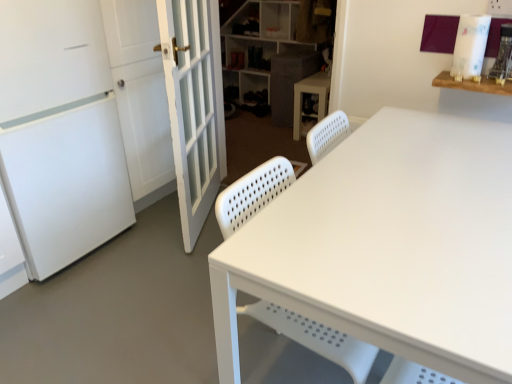
Question: Does white plastic shelf at upper center have a greater width compared to white plastic cabinet at center?

Choices:
 (A) no
 (B) yes

Answer: (B)

Question: Would you consider white plastic shelf at upper center to be distant from white plastic cabinet at center?

Choices:
 (A) yes
 (B) no

Answer: (B)

Question: Considering the relative positions of white plastic shelf at upper center and white plastic cabinet at center in the image provided, is white plastic shelf at upper center to the left of white plastic cabinet at center from the viewer's perspective?

Choices:
 (A) no
 (B) yes

Answer: (B)

Question: Is white plastic shelf at upper center thinner than white plastic cabinet at center?

Choices:
 (A) no
 (B) yes

Answer: (A)

Question: From the image's perspective, is white plastic shelf at upper center below white plastic cabinet at center?

Choices:
 (A) no
 (B) yes

Answer: (A)

Question: Is the depth of white plastic shelf at upper center less than that of white plastic cabinet at center?

Choices:
 (A) yes
 (B) no

Answer: (B)

Question: Considering the relative positions of white matte screen door at left and white perforated plastic swivel chair at center in the image provided, is white matte screen door at left in front of white perforated plastic swivel chair at center?

Choices:
 (A) no
 (B) yes

Answer: (A)

Question: Could you tell me if white matte screen door at left is turned towards white perforated plastic swivel chair at center?

Choices:
 (A) yes
 (B) no

Answer: (A)

Question: Is white matte screen door at left positioned with its back to white perforated plastic swivel chair at center?

Choices:
 (A) no
 (B) yes

Answer: (A)

Question: Considering the relative sizes of white matte screen door at left and white perforated plastic swivel chair at center in the image provided, is white matte screen door at left smaller than white perforated plastic swivel chair at center?

Choices:
 (A) yes
 (B) no

Answer: (B)

Question: From a real-world perspective, is white matte screen door at left below white perforated plastic swivel chair at center?

Choices:
 (A) yes
 (B) no

Answer: (B)

Question: From the image's perspective, is white matte screen door at left over white perforated plastic swivel chair at center?

Choices:
 (A) no
 (B) yes

Answer: (B)

Question: Is textured gray cabinet at center wider than white plastic shelf at upper center?

Choices:
 (A) yes
 (B) no

Answer: (B)